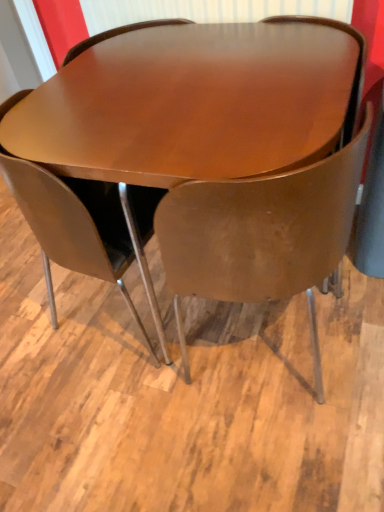
You are a GUI agent. You are given a task and a screenshot of the screen. Output one action in this format:
    pyautogui.click(x=<x>, y=<y>)
    Task: Click on the free point in front of glossy wood table at center
    
    Given the screenshot: What is the action you would take?
    pyautogui.click(x=208, y=435)